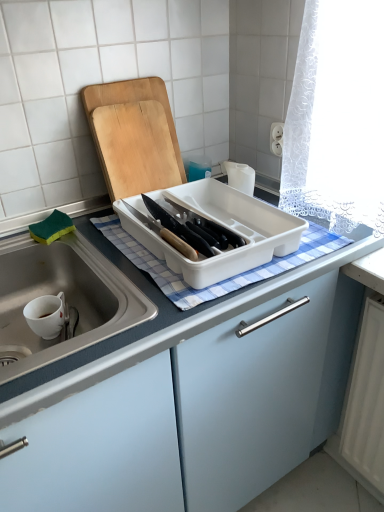
What do you see at coordinates (221, 281) in the screenshot?
I see `blue checkered cloth at center` at bounding box center [221, 281].

In order to face blue checkered cloth at center, should I rotate leftwards or rightwards?

Turn right by 2.054 degrees to look at blue checkered cloth at center.

The height and width of the screenshot is (512, 384). What do you see at coordinates (223, 225) in the screenshot?
I see `white plastic tray at center` at bounding box center [223, 225].

Where is `wooden cutting board at upper center`? This screenshot has height=512, width=384. wooden cutting board at upper center is located at coordinates (134, 136).

Who is shorter, wooden cutting board at upper center or white plastic tray at center?

white plastic tray at center.

Does point (123, 191) lie behind point (265, 216)?

Yes.

Between wooden cutting board at upper center and white plastic tray at center, which one appears on the right side from the viewer's perspective?

white plastic tray at center.

Is wooden cutting board at upper center positioned beyond the bounds of white plastic tray at center?

Yes, wooden cutting board at upper center is located beyond the bounds of white plastic tray at center.

In the scene shown: Could you tell me if wooden cutting board at upper center is turned towards blue checkered cloth at center?

Yes, wooden cutting board at upper center is aimed at blue checkered cloth at center.

Is wooden cutting board at upper center far away from blue checkered cloth at center?

wooden cutting board at upper center is near blue checkered cloth at center, not far away.

Is wooden cutting board at upper center taller or shorter than blue checkered cloth at center?

In the image, wooden cutting board at upper center appears to be taller than blue checkered cloth at center.

Between wooden cutting board at upper center and blue checkered cloth at center, which one appears on the left side from the viewer's perspective?

wooden cutting board at upper center.

Could you tell me if white plastic tray at center is turned towards blue checkered cloth at center?

No, white plastic tray at center is not turned towards blue checkered cloth at center.

Looking at this image, from the image's perspective, is white plastic tray at center above or below blue checkered cloth at center?

Based on their image positions, white plastic tray at center is located above blue checkered cloth at center.

Is white plastic tray at center beside blue checkered cloth at center?

Yes, white plastic tray at center is touching blue checkered cloth at center.

Do you think white plastic tray at center is within blue checkered cloth at center, or outside of it?

white plastic tray at center lies outside blue checkered cloth at center.

How many degrees apart are the facing directions of blue checkered cloth at center and white plastic tray at center?

There is a 2.84e-05-degree angle between the facing directions of blue checkered cloth at center and white plastic tray at center.

Between point (303, 258) and point (164, 253), which one is positioned in front?

The point (303, 258) is more forward.

Is blue checkered cloth at center facing towards white plastic tray at center?

Yes, blue checkered cloth at center is facing white plastic tray at center.

In order to click on tablecloth below the white plastic tray at center (from the image's perspective) in this screenshot , I will do `click(221, 281)`.

From a real-world perspective, who is located lower, white plastic tray at center or wooden cutting board at upper center?

From a 3D spatial view, white plastic tray at center is below.

Image resolution: width=384 pixels, height=512 pixels. What are the coordinates of `cutting board behind the white plastic tray at center` in the screenshot? It's located at (134, 136).

Consider the image. Could wooden cutting board at upper center be considered to be inside white plastic tray at center?

Definitely not — wooden cutting board at upper center is not inside white plastic tray at center.

From the image's perspective, which is above, white plastic tray at center or wooden cutting board at upper center?

From the image's view, wooden cutting board at upper center is above.

Which object is positioned more to the left, blue checkered cloth at center or wooden cutting board at upper center?

From the viewer's perspective, wooden cutting board at upper center appears more on the left side.

Considering the relative positions of blue checkered cloth at center and wooden cutting board at upper center in the image provided, is blue checkered cloth at center behind wooden cutting board at upper center?

No, blue checkered cloth at center is closer to the camera.

In the scene shown: Is blue checkered cloth at center oriented away from wooden cutting board at upper center?

Yes, wooden cutting board at upper center is at the back of blue checkered cloth at center.

Is blue checkered cloth at center directly adjacent to wooden cutting board at upper center?

No, blue checkered cloth at center is not next to wooden cutting board at upper center.

I want to click on kitchen appliance in front of the wooden cutting board at upper center, so coord(223,225).

The height and width of the screenshot is (512, 384). Identify the location of tablecloth below the wooden cutting board at upper center (from a real-world perspective). (221, 281).

Based on their spatial positions, is blue checkered cloth at center or white plastic tray at center closer to wooden cutting board at upper center?

white plastic tray at center is positioned closer to the anchor wooden cutting board at upper center.

Based on their spatial positions, is white plastic tray at center or wooden cutting board at upper center further from blue checkered cloth at center?

Based on the image, wooden cutting board at upper center appears to be further to blue checkered cloth at center.

Considering their positions, is white plastic tray at center positioned closer to wooden cutting board at upper center than blue checkered cloth at center?

white plastic tray at center.

From the image, which object appears to be nearer to blue checkered cloth at center, wooden cutting board at upper center or white plastic tray at center?

Among the two, white plastic tray at center is located nearer to blue checkered cloth at center.

Based on their spatial positions, is wooden cutting board at upper center or blue checkered cloth at center further from white plastic tray at center?

wooden cutting board at upper center is further to white plastic tray at center.

From the image, which object appears to be nearer to white plastic tray at center, blue checkered cloth at center or wooden cutting board at upper center?

blue checkered cloth at center is positioned closer to the anchor white plastic tray at center.

You are a GUI agent. You are given a task and a screenshot of the screen. Output one action in this format:
    pyautogui.click(x=<x>, y=<y>)
    Task: Click on the kitchen appliance between wooden cutting board at upper center and blue checkered cloth at center from top to bottom
    The width and height of the screenshot is (384, 512).
    Given the screenshot: What is the action you would take?
    pos(223,225)